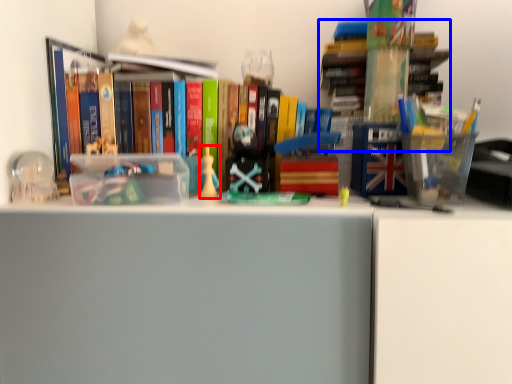
Question: Which of the following is the farthest to the observer, toy (highlighted by a red box) or book (highlighted by a blue box)?

Choices:
 (A) toy
 (B) book

Answer: (A)